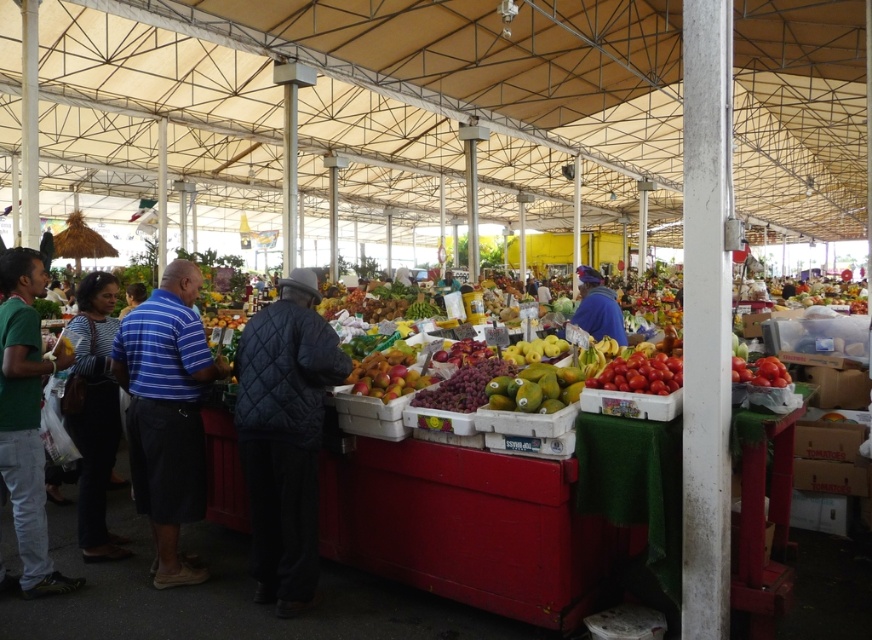
You are a customer at the market and want to buy both the glossy red apples at center and the red matte tomatoes at right. Which item is positioned to the left of the other?

The glossy red apples at center are positioned to the left of the red matte tomatoes at right.

You are a customer at the market and want to place a tall vase between the glossy red apples at center and the red matte tomatoes at right. Can the vase fit vertically between them?

The glossy red apples at center is taller than red matte tomatoes at right, so the vase may not fit vertically between them as there might not be enough vertical space.

You are a customer at the market and want to pick up the glossy red apples at center. You are currently standing 12.79 feet away from them. Can you reach them without moving closer?

The glossy red apples at center are 12.79 feet away from you, so you cannot reach them without moving closer.